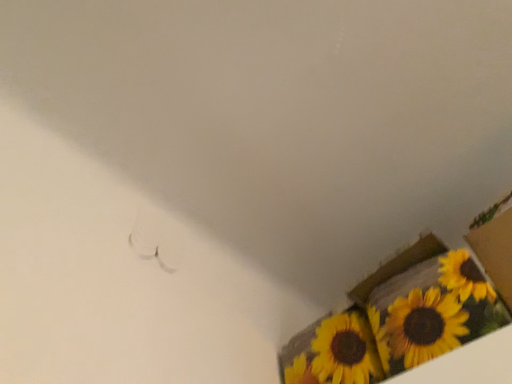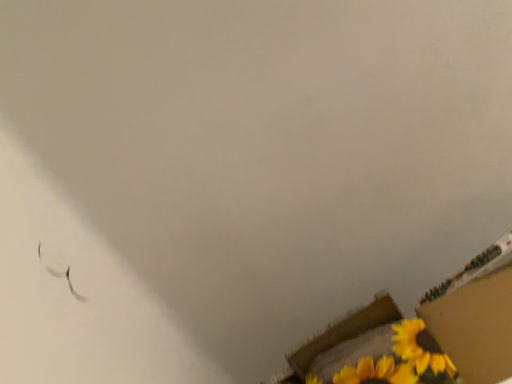
Question: Which way did the camera rotate in the video?

Choices:
 (A) rotated downward
 (B) rotated upward

Answer: (B)